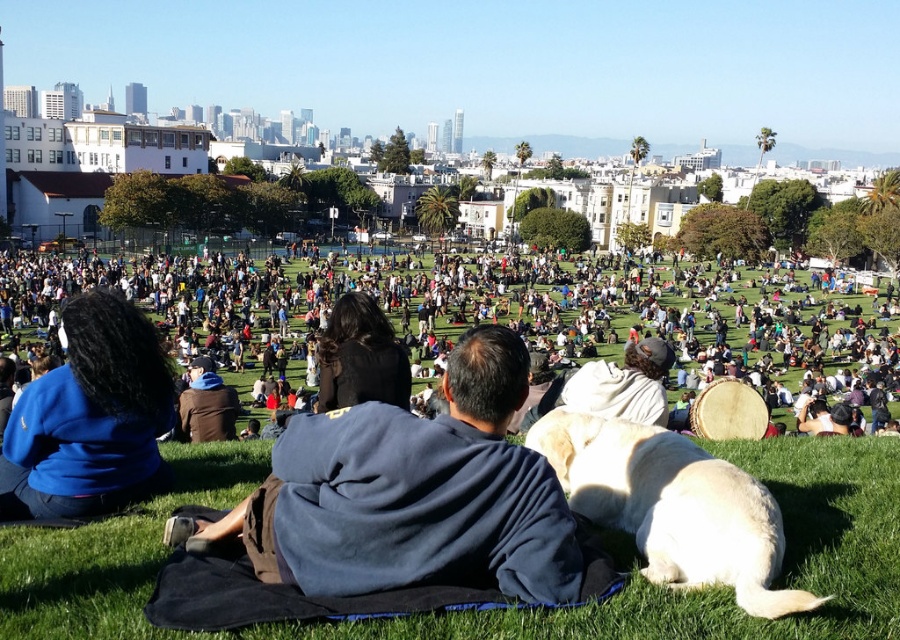
Question: Can you confirm if dark blue fleece at center is thinner than dark blue jacket at lower left?

Choices:
 (A) yes
 (B) no

Answer: (B)

Question: Among these points, which one is farthest from the camera?

Choices:
 (A) (234, 636)
 (B) (117, 504)
 (C) (569, 529)

Answer: (B)

Question: Is blue fleece jacket at lower left above dark blue jacket at lower left?

Choices:
 (A) no
 (B) yes

Answer: (A)

Question: Does green grass at center have a larger size compared to dark blue fleece at center?

Choices:
 (A) yes
 (B) no

Answer: (A)

Question: Estimate the real-world distances between objects in this image. Which object is farther from the light yellow fur at lower center?

Choices:
 (A) green grass at center
 (B) blue fleece jacket at lower left

Answer: (B)

Question: Estimate the real-world distances between objects in this image. Which object is closer to the light yellow fur at lower center?

Choices:
 (A) blue fleece jacket at lower left
 (B) green grass at center

Answer: (B)